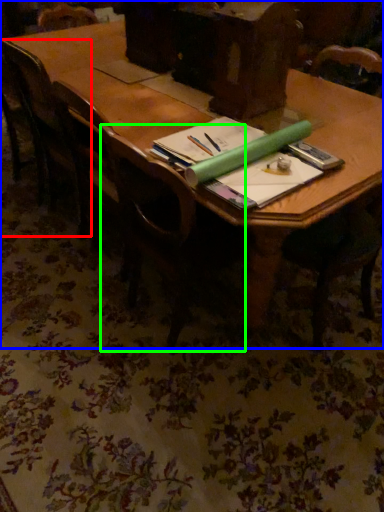
Question: Based on their relative distances, which object is nearer to chair (highlighted by a red box)? Choose from table (highlighted by a blue box) and chair (highlighted by a green box).

Choices:
 (A) table
 (B) chair

Answer: (A)